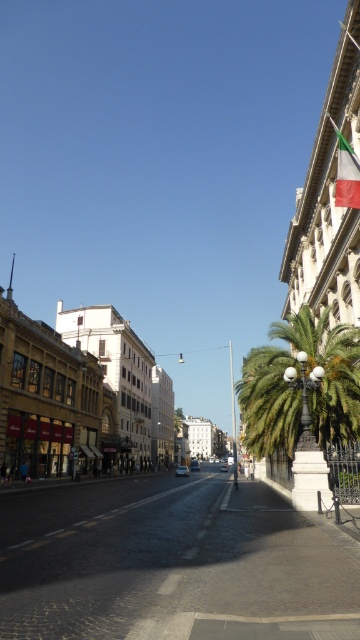
You are a photographer standing in the middle of the street. You want to capture both the green leafy palm tree at right and the green fabric flag at upper right in a single shot. Considering their sizes, which object will appear bigger in your photo?

The green leafy palm tree at right will appear bigger in the photo because it has a larger size compared to the green fabric flag at upper right.

You are a photographer standing in the middle of the street. You want to capture a photo that includes both the green leafy palm tree at right and the green fabric flag at upper right. Which object should you position closer to the left side of your camera frame?

The green leafy palm tree at right should be positioned closer to the left side of your camera frame because it is located to the left of the green fabric flag at upper right in the scene.